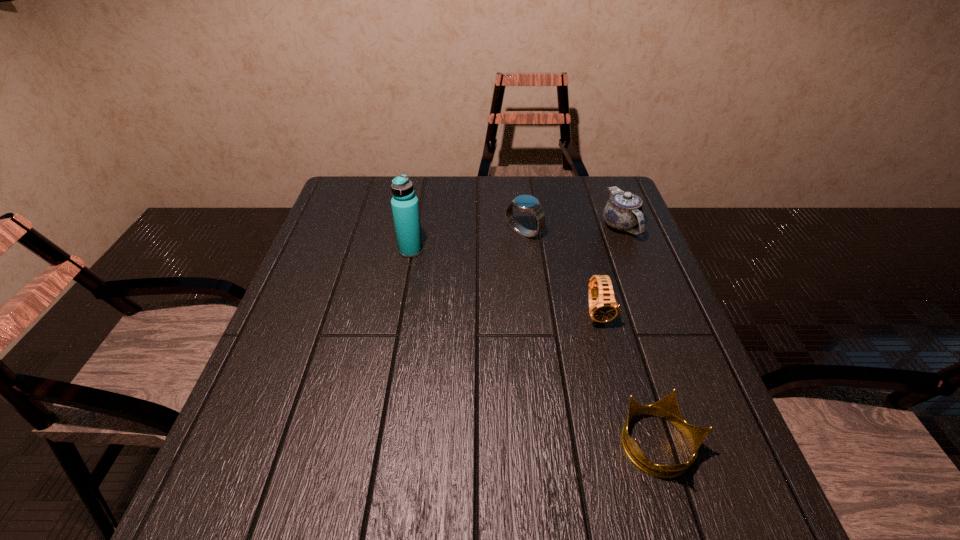
Where is `object at the near right corner`? The height and width of the screenshot is (540, 960). object at the near right corner is located at coordinates (667, 408).

Identify the location of free space at the far edge of the desktop. This screenshot has height=540, width=960. (461, 177).

The height and width of the screenshot is (540, 960). I want to click on vacant position at the near edge of the desktop, so click(x=579, y=531).

The width and height of the screenshot is (960, 540). In the image, there is a desktop. What are the coordinates of `vacant space at the left edge` in the screenshot? It's located at (326, 286).

Image resolution: width=960 pixels, height=540 pixels. I want to click on vacant point at the right edge, so click(636, 270).

In the image, there is a desktop. At what (x,y) coordinates should I click in order to perform the action: click on vacant space at the far right corner. Please return your answer as a coordinate pair (x, y). This screenshot has height=540, width=960. Looking at the image, I should click on (599, 199).

The width and height of the screenshot is (960, 540). What are the coordinates of `vacant space that's between the right watch and the tallest object` in the screenshot? It's located at (504, 281).

At what (x,y) coordinates should I click in order to perform the action: click on vacant point located between the nearest object and the water bottle. Please return your answer as a coordinate pair (x, y). Looking at the image, I should click on (535, 348).

Where is `free spot between the tallest object and the shortest object`? free spot between the tallest object and the shortest object is located at coordinates pos(535,348).

This screenshot has height=540, width=960. Find the location of `free space between the chinaware and the leftmost object`. free space between the chinaware and the leftmost object is located at coordinates (516, 238).